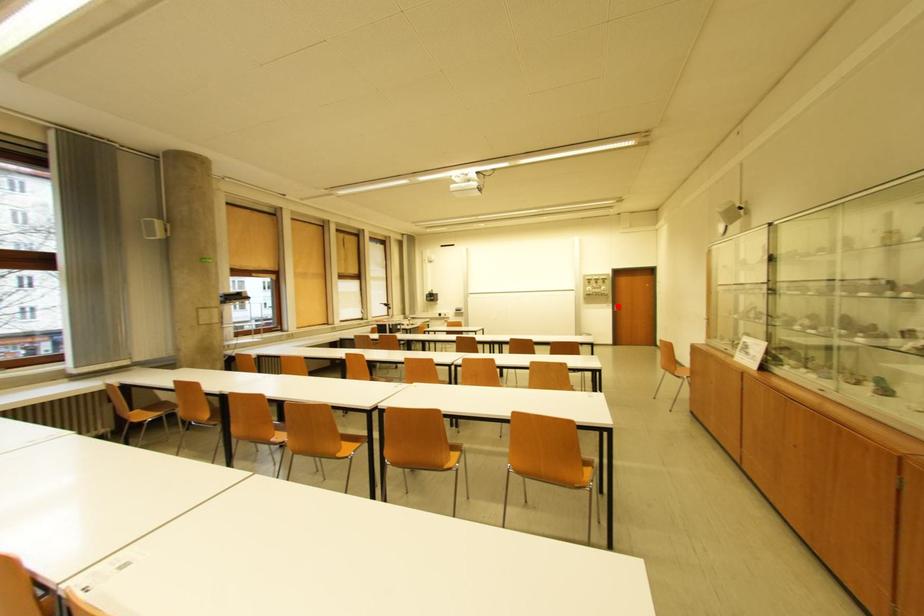
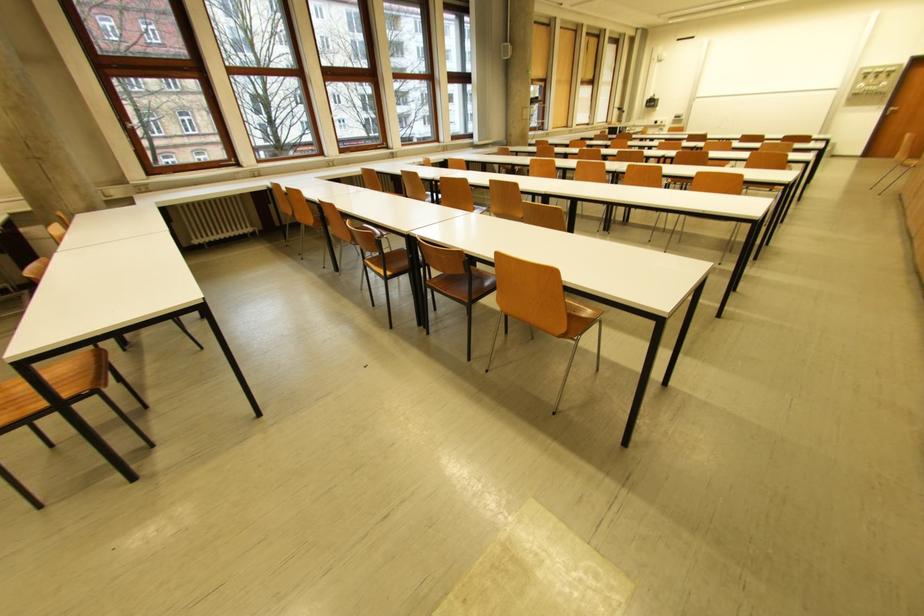
In the second image, find the point that corresponds to the highlighted location in the first image.

(891, 108)